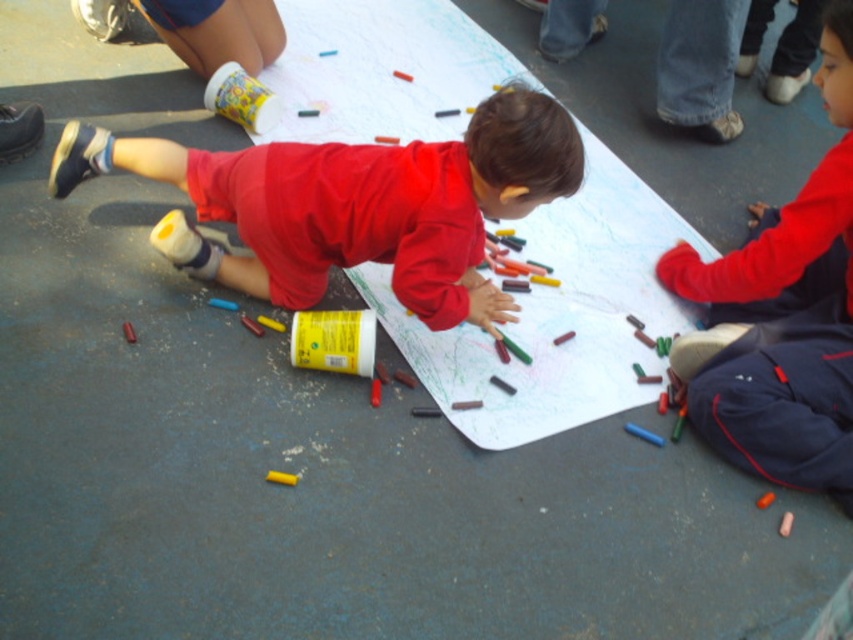
Between point (352, 200) and point (838, 179), which one is positioned in front?

Point (838, 179)

Is point (82, 132) positioned behind point (836, 198)?

That is True.

Who is more distant from viewer, (428,288) or (844,1)?

The point (428,288) is more distant.

I want to click on matte red shirt at center, so click(x=357, y=204).